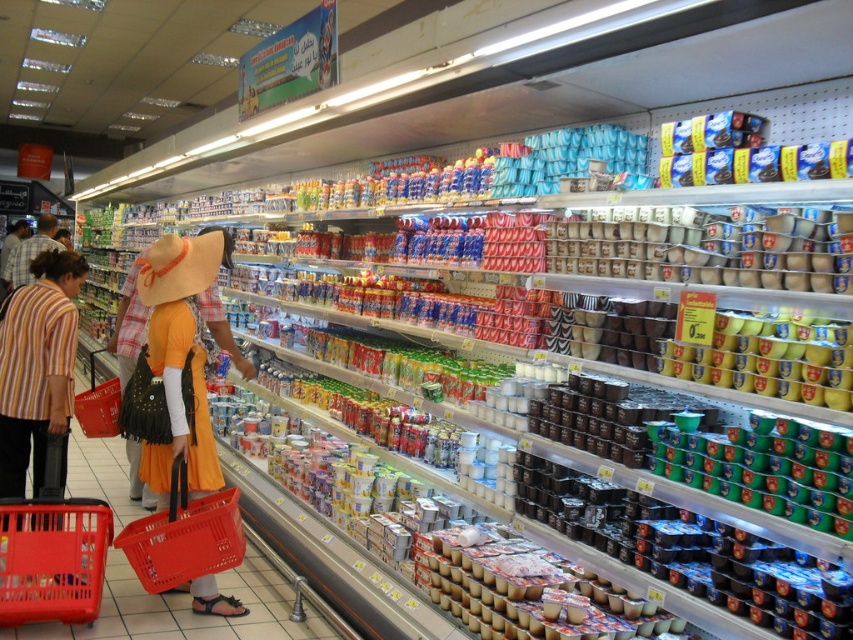
You are standing in the grocery store and see two baskets in the foreground. Which basket, the plastic shopping basket at lower left or the matte plastic basket at lower left, is closer to you?

The plastic shopping basket at lower left is closer to the viewer than the matte plastic basket at lower left.

You are a store employee and need to place a new yogurt container on the shelf. You see the plastic shopping basket at lower left and the matte plastic basket at lower left. Which basket is closer to the floor?

The plastic shopping basket at lower left is closer to the floor because it is positioned below the matte plastic basket at lower left.